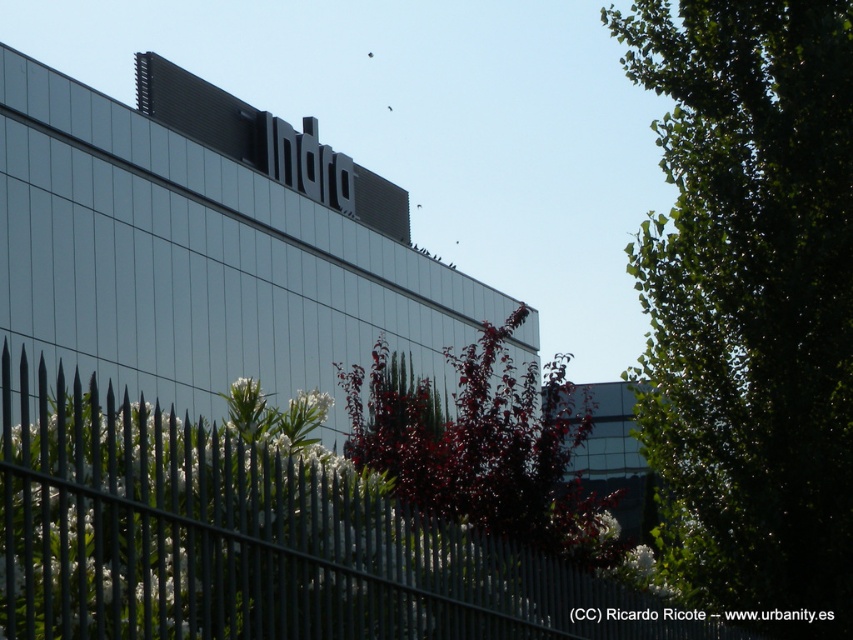
How distant is metallic gray fence at lower left from dark red leafy tree at center?

The distance of metallic gray fence at lower left from dark red leafy tree at center is 19.42 meters.

Who is more forward, [57,627] or [576,442]?

Point [57,627]

Locate an element on the screen. Image resolution: width=853 pixels, height=640 pixels. metallic gray fence at lower left is located at coordinates (252, 541).

Can you confirm if green leafy tree at right is smaller than metallic gray fence at lower left?

Incorrect, green leafy tree at right is not smaller in size than metallic gray fence at lower left.

Which is more to the right, green leafy tree at right or metallic gray fence at lower left?

green leafy tree at right

Which is in front, point (740, 61) or point (141, 554)?

Point (141, 554) is in front.

Where is `green leafy tree at right`? green leafy tree at right is located at coordinates (749, 301).

Can you confirm if green leafy tree at right is shorter than dark red leafy tree at center?

No, green leafy tree at right is not shorter than dark red leafy tree at center.

Which is in front, point (753, 388) or point (599, 515)?

Positioned in front is point (753, 388).

Where is `green leafy tree at right`? The height and width of the screenshot is (640, 853). green leafy tree at right is located at coordinates (749, 301).